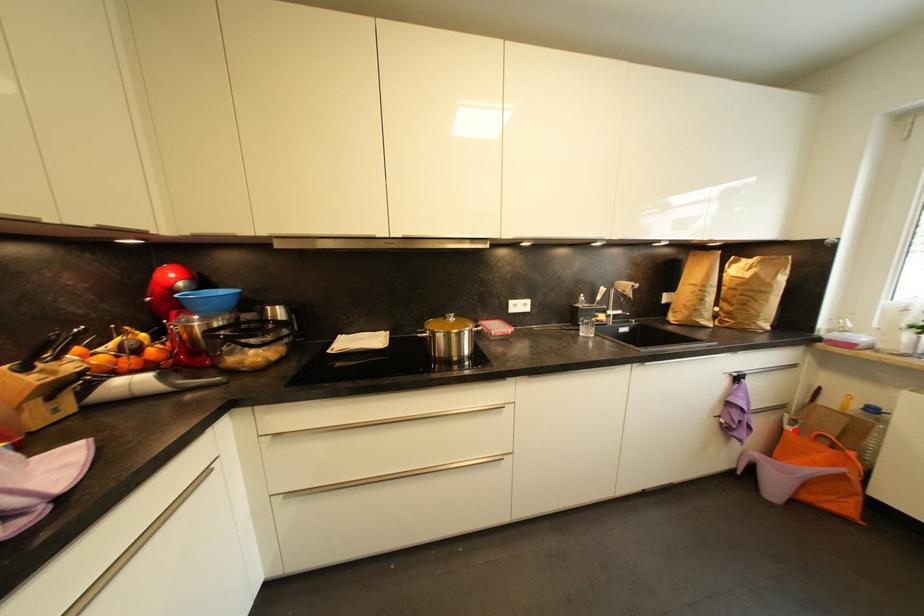
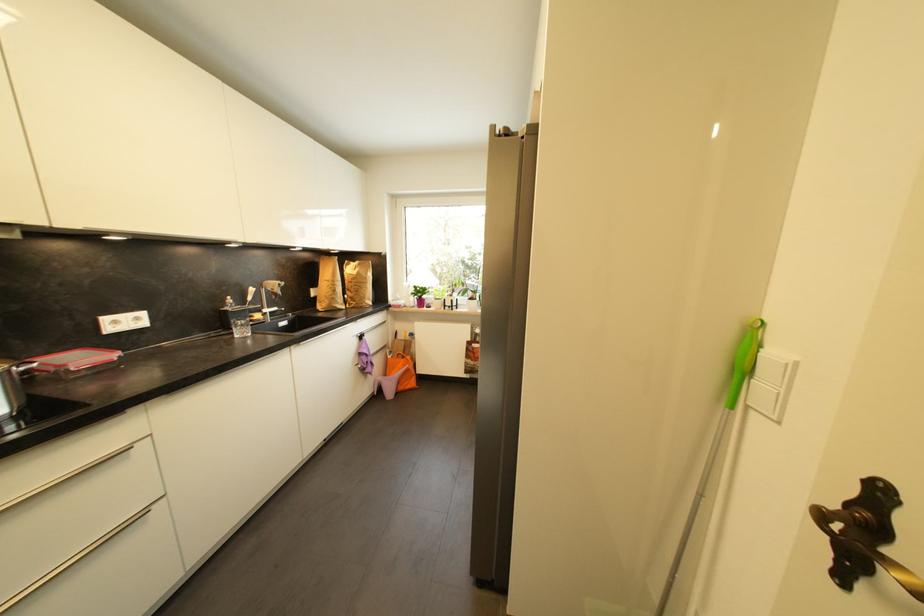
Question: I am providing you with two images of the same scene from different viewpoints. A red point is shown in image1. For the corresponding object point in image2, is it positioned nearer or farther from the camera?

Choices:
 (A) Nearer
 (B) Farther

Answer: (B)